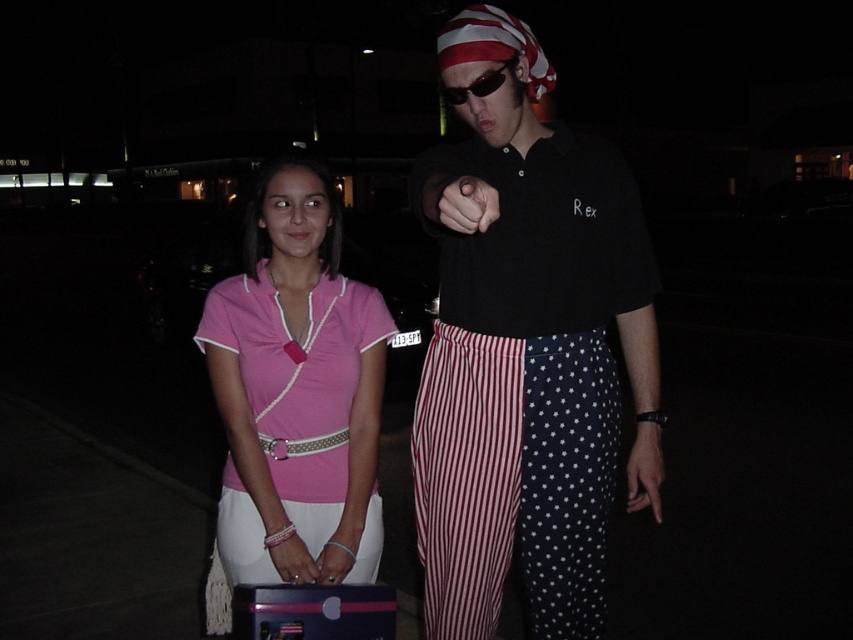
You are a security camera observing the scene. You notice the pink fabric shirt at center and the black matte hand at center. Which object is located more to the left?

The pink fabric shirt at center is positioned on the left side of black matte hand at center, so the pink fabric shirt at center is more to the left.

You are standing in a dark parking lot and see a point at coordinates (527, 353). What object is located at that point?

The point at coordinates (527, 353) corresponds to the black cotton shirt at center.

You are a security camera observing the scene. There is a black matte hand at center and sunglasses at center. Which object is positioned lower?

The black matte hand at center is below sunglasses at center, so the black matte hand at center is positioned lower.